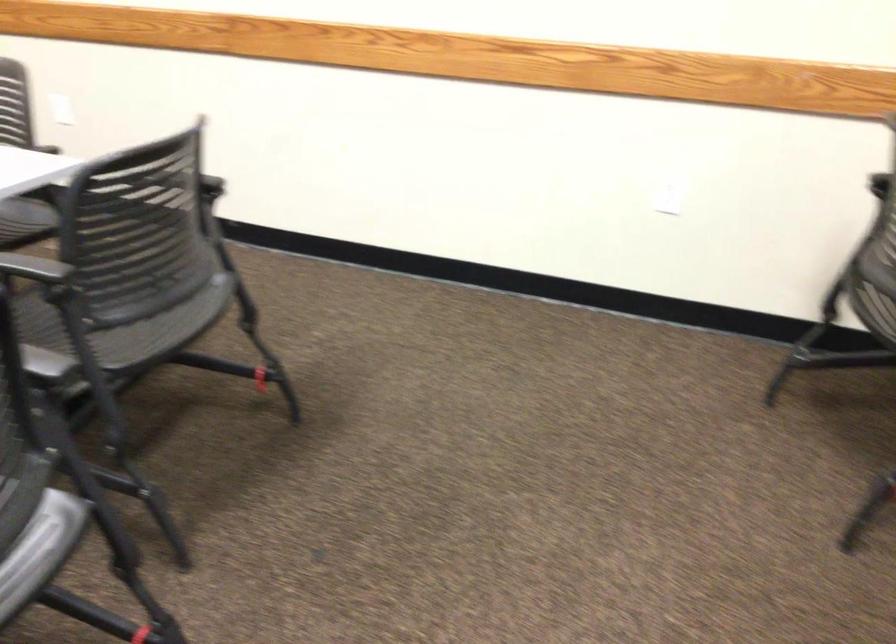
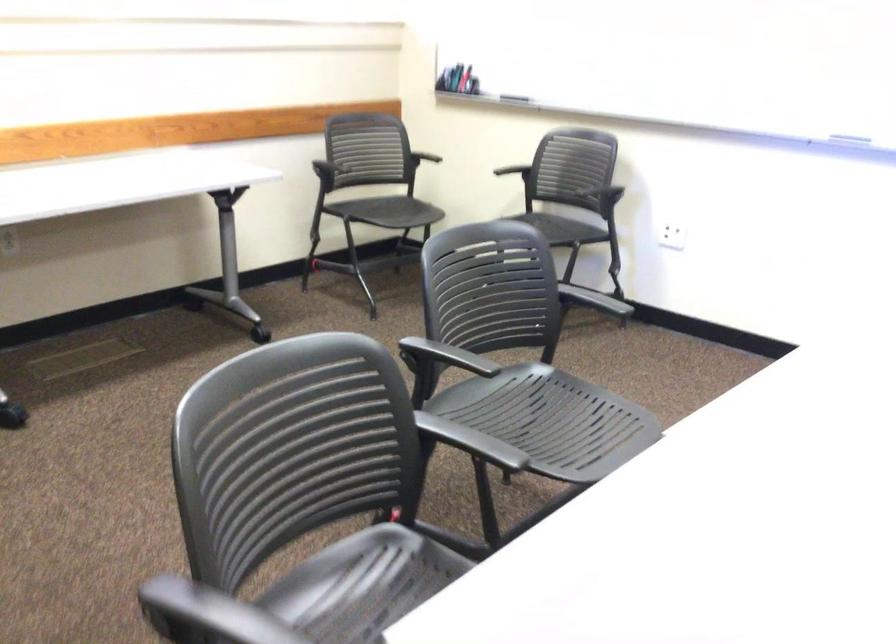
In the second image, find the point that corresponds to (158,362) in the first image.

(362, 585)